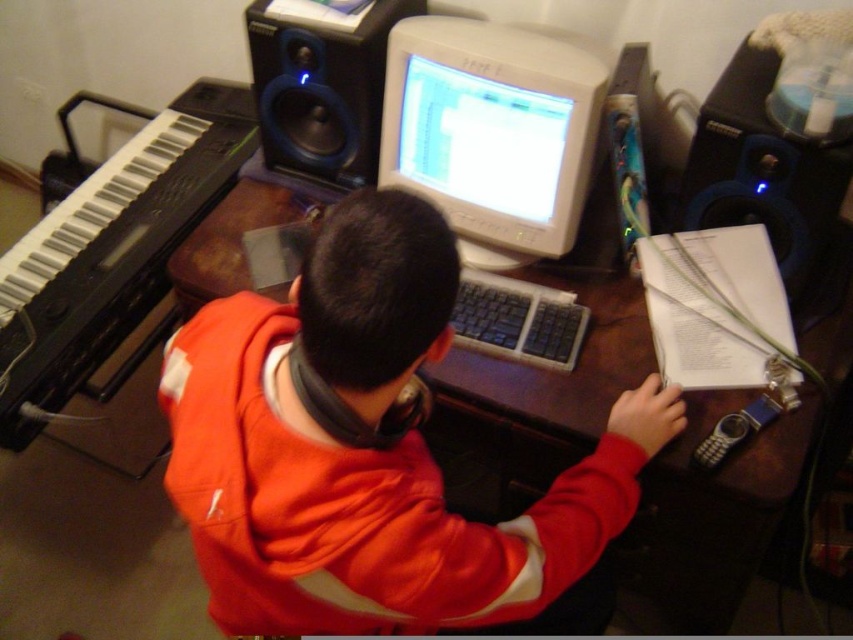
You are a photographer setting up a shoot in the scene. You need to place a small tripod between the orange fleece jacket at center and the blue plastic speaker at right. Based on their positions, where should you position the tripod?

The orange fleece jacket at center is located below the blue plastic speaker at right, so you should place the tripod between them horizontally, positioning it in the middle area between the jacket and the speaker.

You are organizing a photo shoot and need to place a camera on the desk. The camera requires a space that is not occupied by any objects. Based on the scene description, where can you place the camera on the desk to avoid the orange fleece jacket at center?

The orange fleece jacket at center is located at point (373, 454). To avoid this, place the camera in an area of the desk that does not overlap with these coordinates, such as near the edges or corners where there are no objects mentioned.

You are setting up a home studio and need to place a 1.5m tall amplifier between the blue plastic speaker at right and the matte black speaker at upper center. Can the amplifier fit vertically between them based on their heights?

The blue plastic speaker at right is taller than the matte black speaker at upper center. Since the amplifier is 1.5m tall, which is taller than both speakers, it cannot fit vertically between them as the space between them is limited by the shorter matte black speaker at upper center.